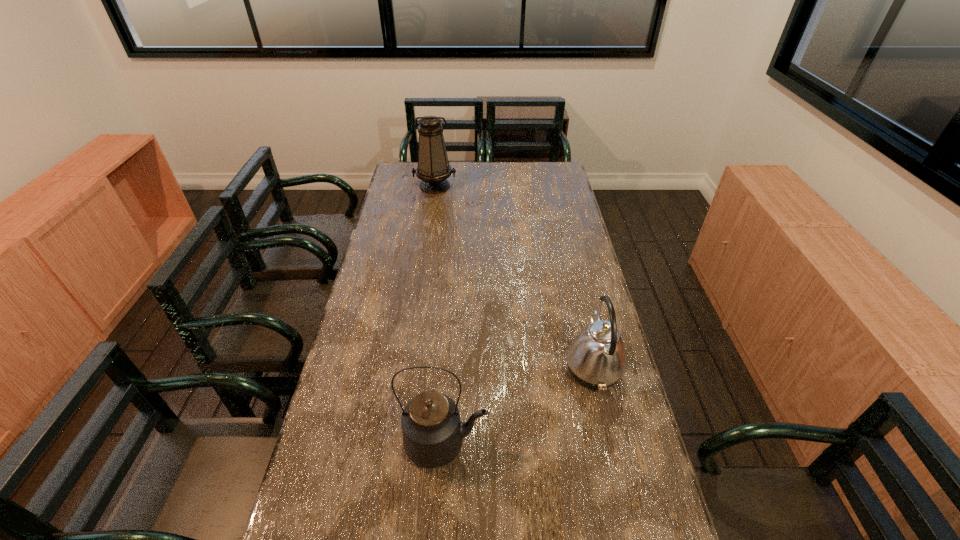
At what (x,y) coordinates should I click in order to perform the action: click on the farthest object. Please return your answer as a coordinate pair (x, y). The height and width of the screenshot is (540, 960). Looking at the image, I should click on (433, 169).

The width and height of the screenshot is (960, 540). In order to click on the nearer kettle in this screenshot , I will do `click(432, 431)`.

What are the coordinates of `the nearest object` in the screenshot? It's located at (432, 431).

The width and height of the screenshot is (960, 540). What are the coordinates of `the shorter kettle` in the screenshot? It's located at (596, 358).

Where is `the right kettle`? the right kettle is located at coordinates (596, 358).

What are the coordinates of `free space located 0.320m on the right of the farthest object` in the screenshot? It's located at (525, 186).

Identify the location of vacant space situated spout on the nearer kettle. The height and width of the screenshot is (540, 960). (589, 443).

This screenshot has width=960, height=540. What are the coordinates of `free spot located from the spout of the rightmost object` in the screenshot? It's located at (527, 368).

The image size is (960, 540). I want to click on vacant region located from the spout of the rightmost object, so click(540, 368).

The height and width of the screenshot is (540, 960). Find the location of `free space located from the spout of the rightmost object`. free space located from the spout of the rightmost object is located at coordinates (482, 368).